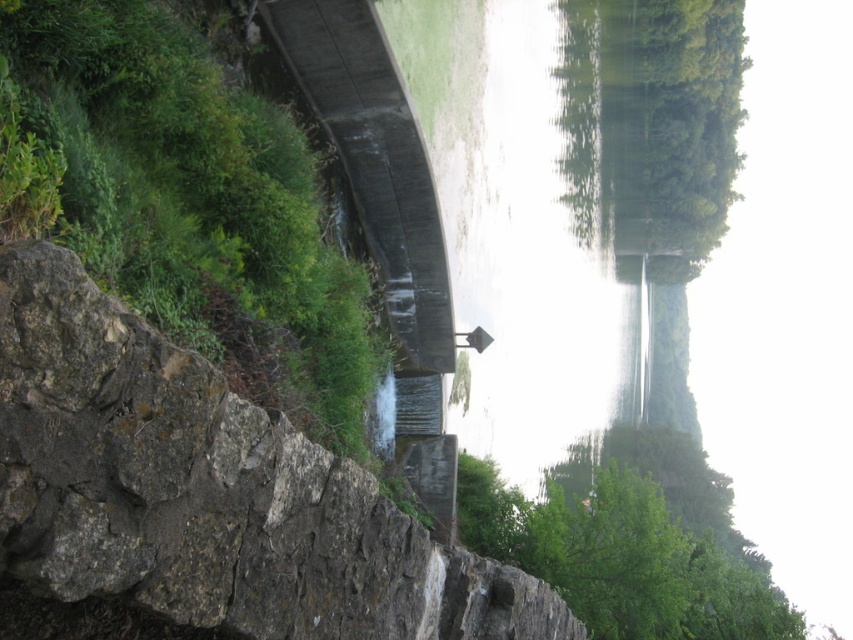
Question: Is brown rough stone at center bigger than green leafy vegetation at lower left?

Choices:
 (A) yes
 (B) no

Answer: (B)

Question: Which point appears farthest from the camera in this image?

Choices:
 (A) (171, 589)
 (B) (611, 592)

Answer: (B)

Question: Which point appears farthest from the camera in this image?

Choices:
 (A) (247, 193)
 (B) (136, 321)
 (C) (590, 545)

Answer: (C)

Question: Which of the following is the closest to the observer?

Choices:
 (A) (135, 136)
 (B) (332, 547)
 (C) (546, 484)

Answer: (B)

Question: Is green leafy vegetation at lower left to the left of green leafy tree at lower right from the viewer's perspective?

Choices:
 (A) yes
 (B) no

Answer: (A)

Question: Can you confirm if green leafy vegetation at lower left is thinner than green leafy tree at lower right?

Choices:
 (A) yes
 (B) no

Answer: (A)